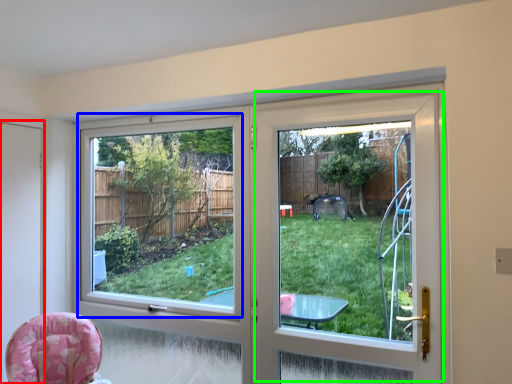
Question: Estimate the real-world distances between objects in this image. Which object is farther from screen door (highlighted by a red box), window screen (highlighted by a blue box) or screen door (highlighted by a green box)?

Choices:
 (A) window screen
 (B) screen door

Answer: (A)